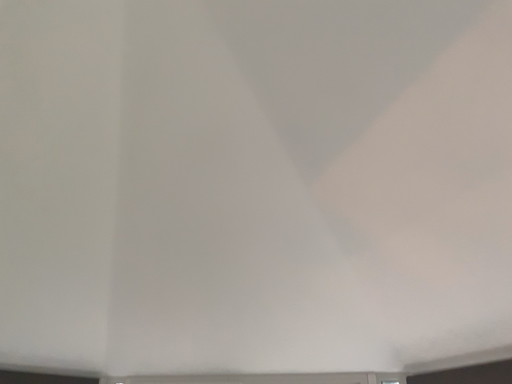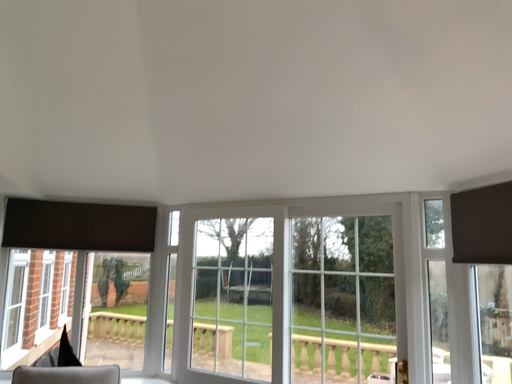
Question: Which way did the camera rotate in the video?

Choices:
 (A) rotated right
 (B) rotated left

Answer: (B)